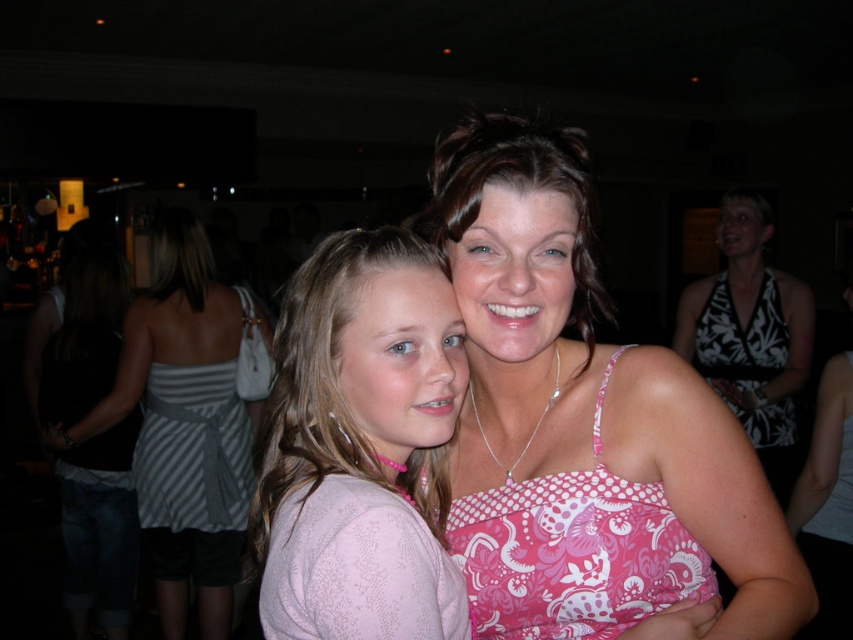
Question: Is pink patterned tank top at center below white floral print dress at right?

Choices:
 (A) no
 (B) yes

Answer: (A)

Question: Which object is closer to the camera taking this photo?

Choices:
 (A) pink dotted tank top at center
 (B) pink patterned tank top at center
 (C) white floral print dress at right

Answer: (B)

Question: Which object is the closest to the pink patterned tank top at center?

Choices:
 (A) pink fabric dress at center
 (B) pink dotted tank top at center
 (C) white floral dress at right

Answer: (B)

Question: Does white floral dress at right have a smaller size compared to white floral print dress at right?

Choices:
 (A) yes
 (B) no

Answer: (B)

Question: Where is striped fabric dress at left located in relation to pink patterned dress at center in the image?

Choices:
 (A) left
 (B) right

Answer: (A)

Question: Which point is farther to the camera?

Choices:
 (A) striped fabric dress at left
 (B) pink patterned dress at center
 (C) pink dotted tank top at center

Answer: (A)